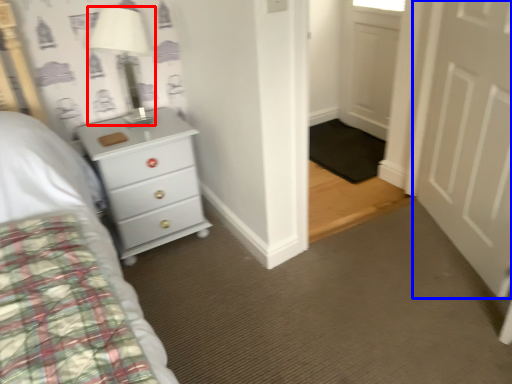
Question: Which object is further to the camera taking this photo, lamp (highlighted by a red box) or door (highlighted by a blue box)?

Choices:
 (A) lamp
 (B) door

Answer: (A)